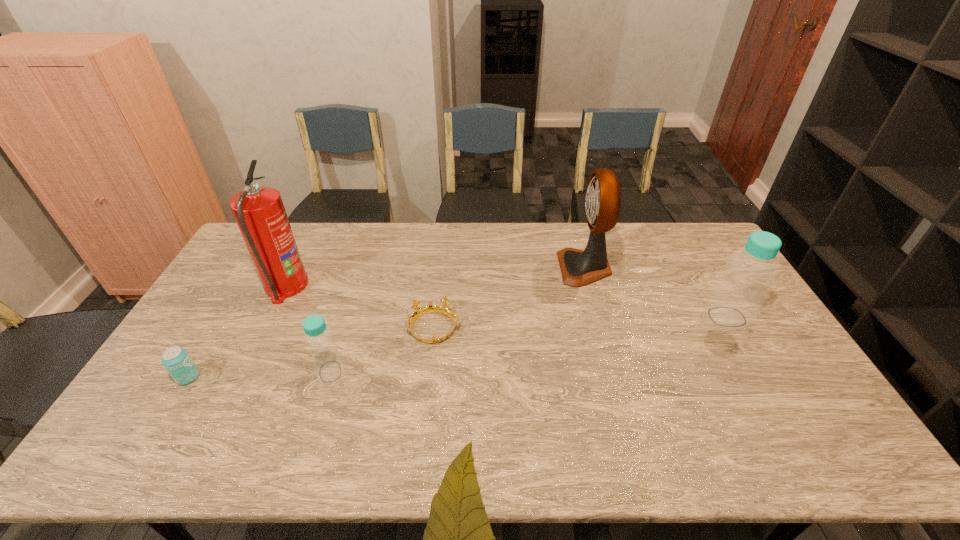
Identify the location of the fourth object from right to left. [x=318, y=338].

Find the location of a particular element. the fourth tallest object is located at coordinates (318, 338).

The width and height of the screenshot is (960, 540). I want to click on the fourth shortest object, so tap(738, 294).

I want to click on the farther bottle, so click(x=738, y=294).

What are the coordinates of `the second object from left to right` in the screenshot? It's located at (259, 212).

This screenshot has height=540, width=960. Identify the location of fan. (578, 268).

Where is `the third object from right to left`? the third object from right to left is located at coordinates (442, 309).

This screenshot has height=540, width=960. Identify the location of the shortest object. (442, 309).

Locate an element on the screen. The width and height of the screenshot is (960, 540). the leftmost object is located at coordinates (176, 360).

I want to click on beer can, so click(176, 360).